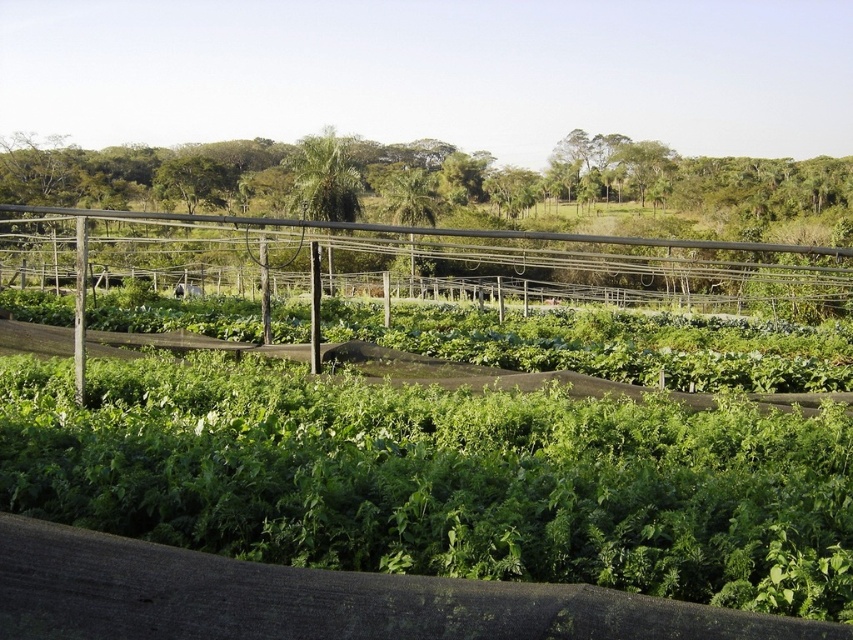
Question: Can you confirm if green leafy plant at center is bigger than wooden fence at center?

Choices:
 (A) no
 (B) yes

Answer: (A)

Question: Which object appears closest to the camera in this image?

Choices:
 (A) wooden fence at center
 (B) green leafy plant at center

Answer: (B)

Question: Which object is farther from the camera taking this photo?

Choices:
 (A) green leafy plant at center
 (B) wooden fence at center

Answer: (B)

Question: Is green leafy plant at center thinner than wooden fence at center?

Choices:
 (A) yes
 (B) no

Answer: (A)

Question: Where is green leafy plant at center located in relation to wooden fence at center in the image?

Choices:
 (A) above
 (B) below

Answer: (B)